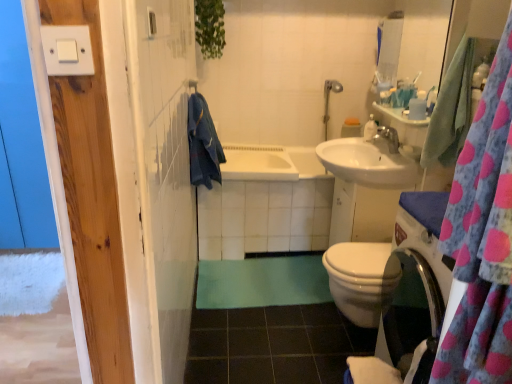
The height and width of the screenshot is (384, 512). Identify the location of vacant space situated above white ceramic bathtub at center, which ranks as the first bath in bottom-to-top order (from a real-world perspective). (263, 155).